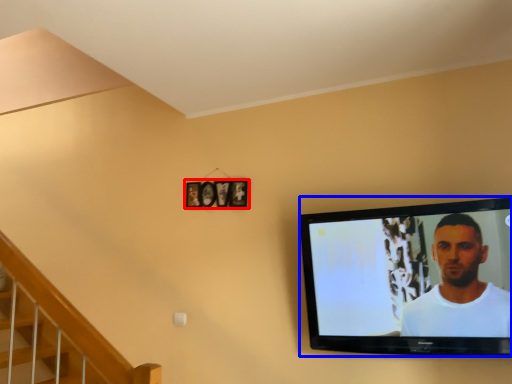
Question: Which of the following is the farthest to the observer, picture frame (highlighted by a red box) or television (highlighted by a blue box)?

Choices:
 (A) picture frame
 (B) television

Answer: (A)